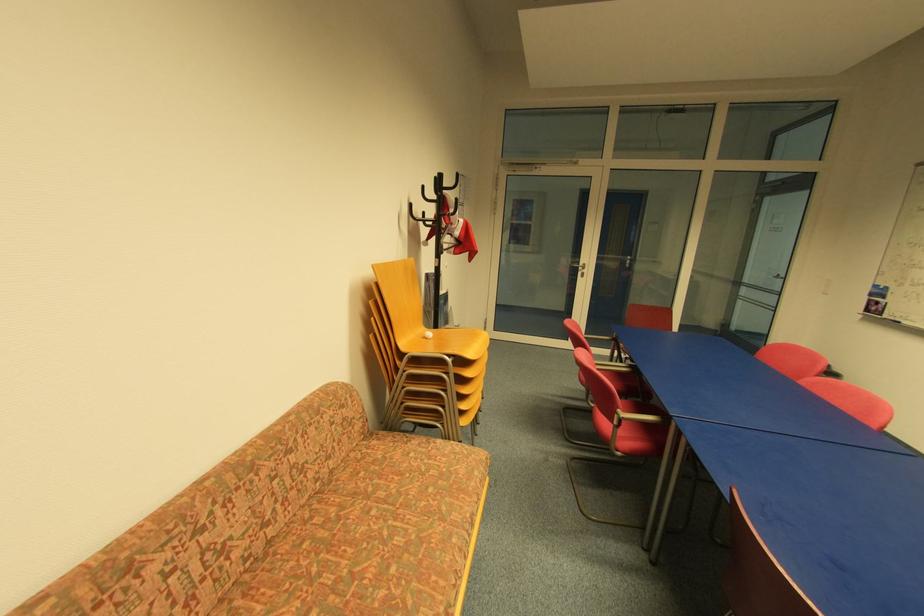
This screenshot has width=924, height=616. Identify the location of silver door handle. (577, 267).